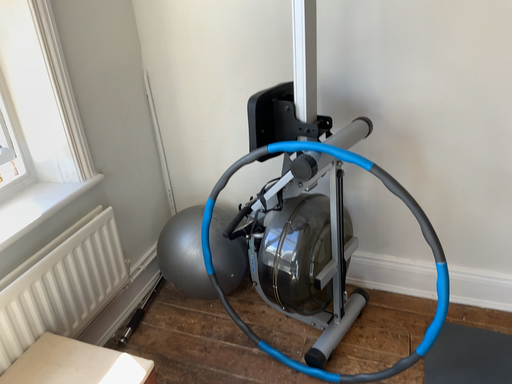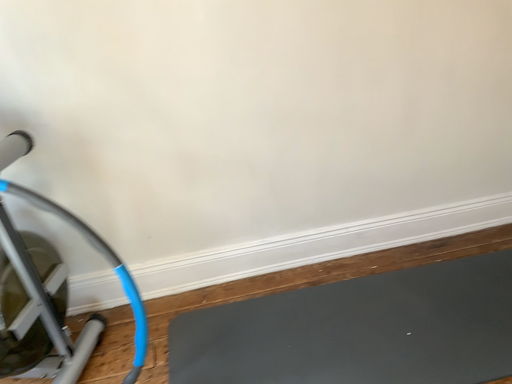
Question: Which way did the camera rotate in the video?

Choices:
 (A) rotated left
 (B) rotated right

Answer: (B)